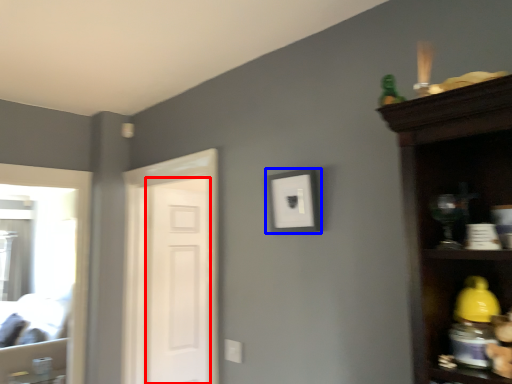
Question: Which of the following is the closest to the observer, screen door (highlighted by a red box) or picture frame (highlighted by a blue box)?

Choices:
 (A) screen door
 (B) picture frame

Answer: (B)